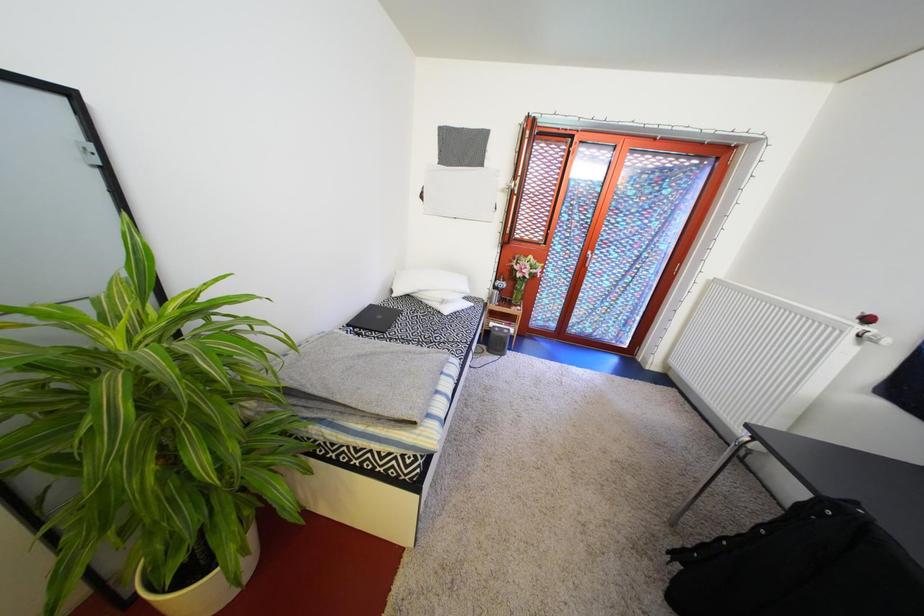
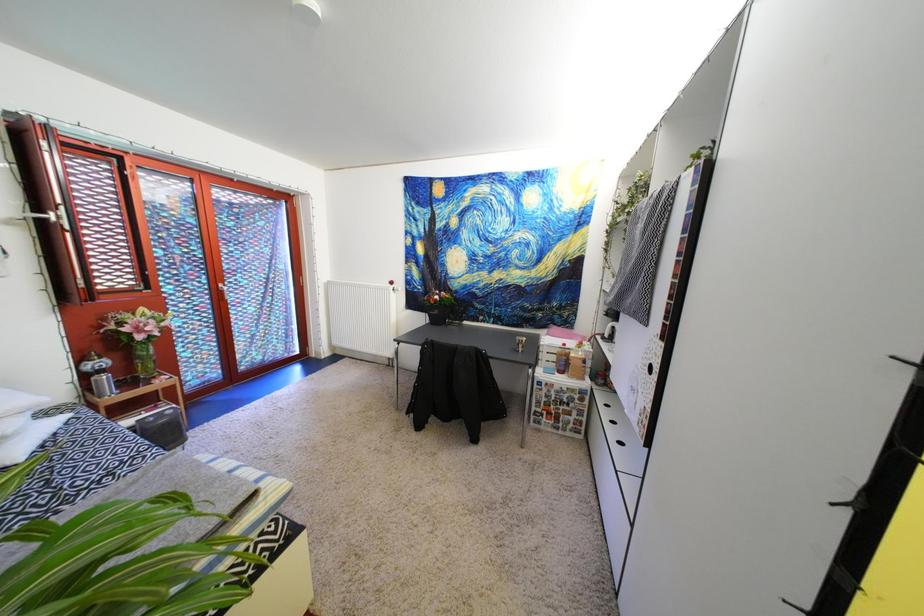
Question: The camera is either moving clockwise (left) or counter-clockwise (right) around the object. The first image is from the beginning of the video and the second image is from the end. Is the camera moving left or right when shooting the video?

Choices:
 (A) Left
 (B) Right

Answer: (A)